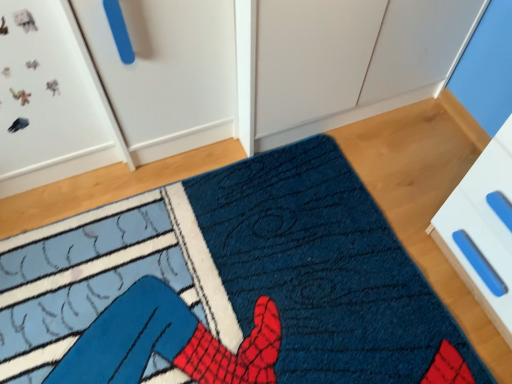
Question: Would you say white plastic drawer at lower right is inside or outside textured blue rug at center?

Choices:
 (A) inside
 (B) outside

Answer: (B)

Question: Is point (496, 279) closer or farther from the camera than point (314, 168)?

Choices:
 (A) farther
 (B) closer

Answer: (B)

Question: From a real-world perspective, is white plastic drawer at lower right physically located above or below textured blue rug at center?

Choices:
 (A) below
 (B) above

Answer: (B)

Question: Is textured blue rug at center wider or thinner than white plastic drawer at lower right?

Choices:
 (A) wide
 (B) thin

Answer: (A)

Question: Considering the positions of textured blue rug at center and white plastic drawer at lower right in the image, is textured blue rug at center taller or shorter than white plastic drawer at lower right?

Choices:
 (A) short
 (B) tall

Answer: (A)

Question: From a real-world perspective, is textured blue rug at center positioned above or below white plastic drawer at lower right?

Choices:
 (A) above
 (B) below

Answer: (B)

Question: Based on their sizes in the image, would you say textured blue rug at center is bigger or smaller than white plastic drawer at lower right?

Choices:
 (A) big
 (B) small

Answer: (B)